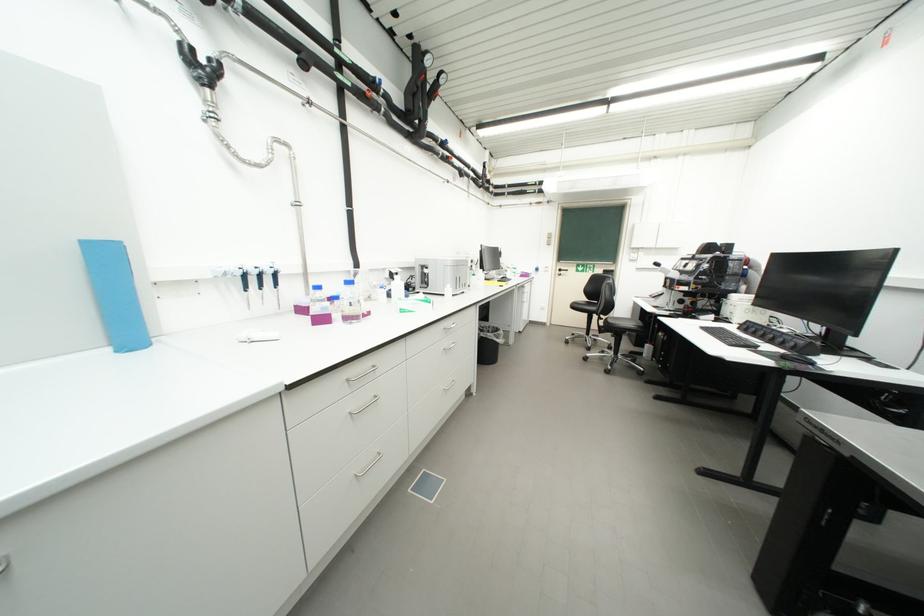
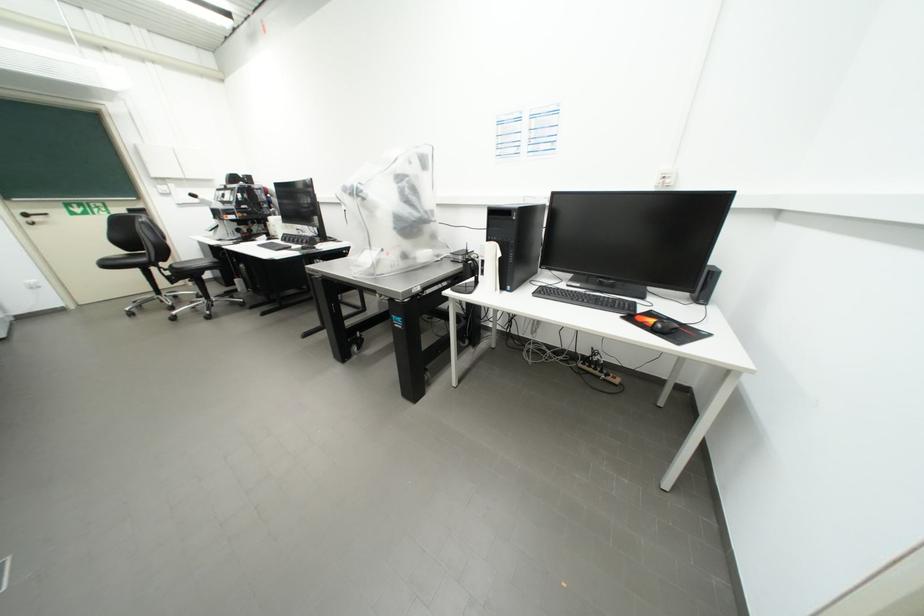
Locate, in the second image, the point that corresponds to the point at 591,334 in the first image.

(160, 296)